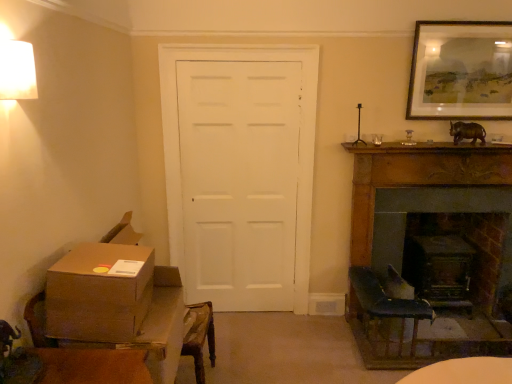
The height and width of the screenshot is (384, 512). I want to click on free spot above wooden framed artwork at upper right (from a real-world perspective), so click(x=471, y=23).